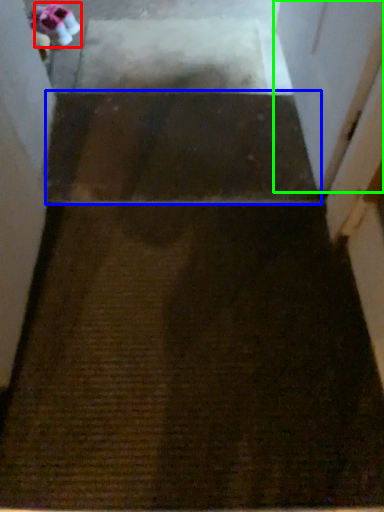
Question: Based on their relative distances, which object is nearer to shoe (highlighted by a red box)? Choose from stairwell (highlighted by a blue box) and screen door (highlighted by a green box).

Choices:
 (A) stairwell
 (B) screen door

Answer: (A)